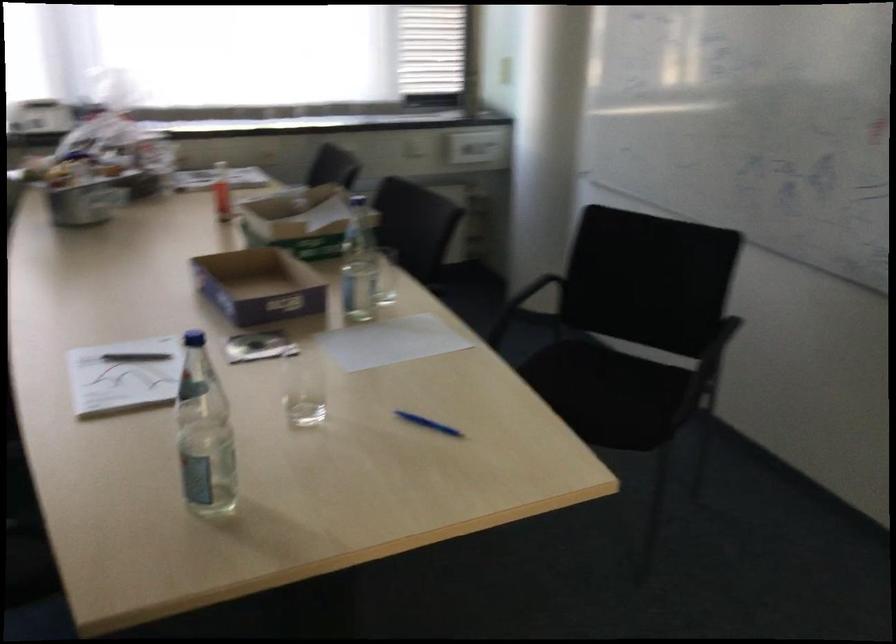
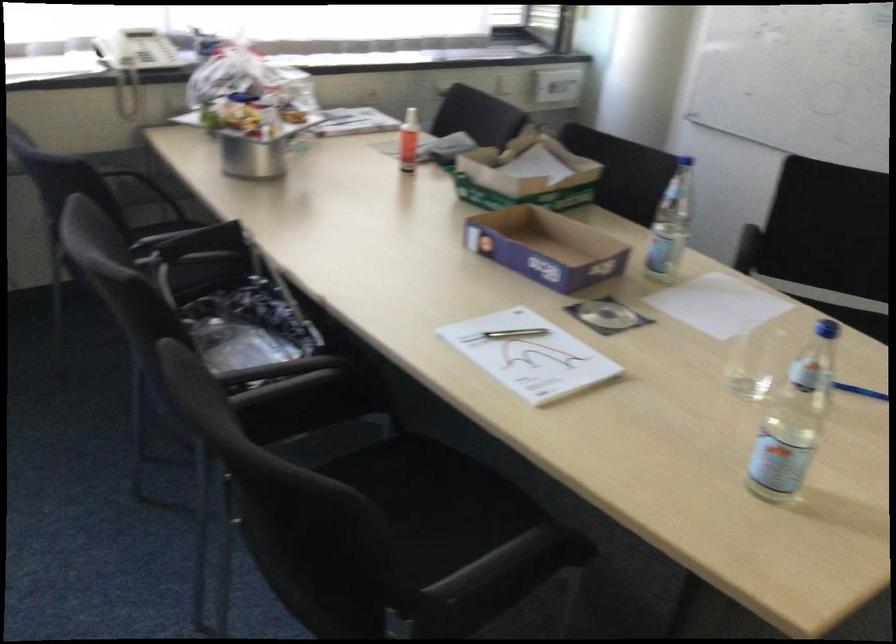
Where in the second image is the point corresponding to (288,222) from the first image?

(526, 175)